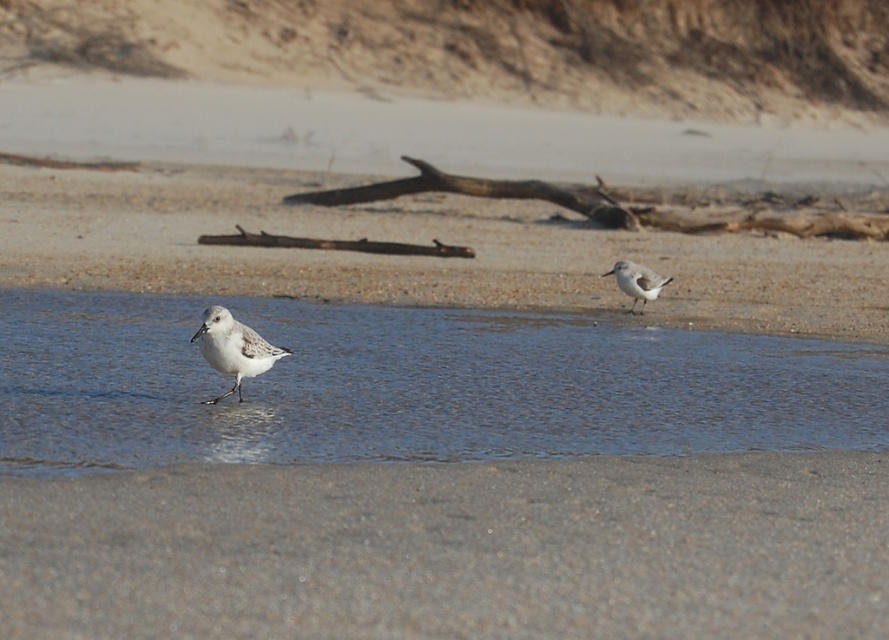
The image size is (889, 640). What do you see at coordinates (415, 259) in the screenshot? I see `white sand at center` at bounding box center [415, 259].

Who is more distant from viewer, (255, 211) or (763, 221)?

Point (255, 211)

This screenshot has width=889, height=640. What do you see at coordinates (415, 259) in the screenshot?
I see `white sand at center` at bounding box center [415, 259].

Locate an element on the screen. white sand at center is located at coordinates (415, 259).

Can you confirm if clear water at center is positioned to the left of brown rough log at center?

Yes, clear water at center is to the left of brown rough log at center.

Does clear water at center appear on the right side of brown rough log at center?

In fact, clear water at center is to the left of brown rough log at center.

Is point (338, 392) closer to viewer compared to point (862, 221)?

Yes, it is.

Locate an element on the screen. clear water at center is located at coordinates (409, 387).

Measure the distance between point (501,180) and camera.

The distance of point (501,180) from camera is 55.98 feet.

Which is in front, point (759, 212) or point (670, 276)?

Positioned in front is point (670, 276).

Locate an element on the screen. The height and width of the screenshot is (640, 889). brown rough log at center is located at coordinates (619, 205).

In order to click on brown rough log at center in this screenshot , I will do `click(619, 205)`.